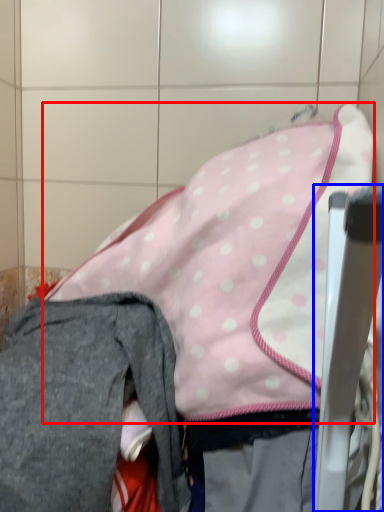
Question: Among these objects, which one is farthest to the camera, wide (highlighted by a red box) or chair (highlighted by a blue box)?

Choices:
 (A) wide
 (B) chair

Answer: (A)